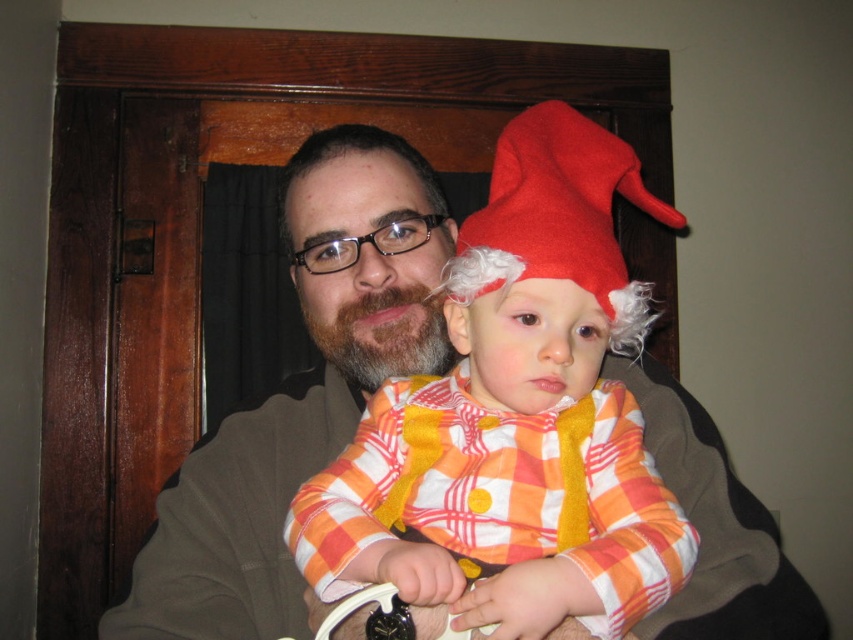
Question: Does matte brown jacket at center have a larger size compared to felt red hat at center?

Choices:
 (A) no
 (B) yes

Answer: (B)

Question: Which point is closer to the camera?

Choices:
 (A) (229, 595)
 (B) (505, 195)

Answer: (B)

Question: Which object is closer to the camera taking this photo?

Choices:
 (A) felt red hat at center
 (B) matte brown jacket at center

Answer: (B)

Question: Can you confirm if matte brown jacket at center is positioned below felt red hat at center?

Choices:
 (A) yes
 (B) no

Answer: (A)

Question: Does matte brown jacket at center appear over felt red hat at center?

Choices:
 (A) no
 (B) yes

Answer: (A)

Question: Which of the following is the closest to the observer?

Choices:
 (A) (352, 413)
 (B) (534, 147)

Answer: (B)